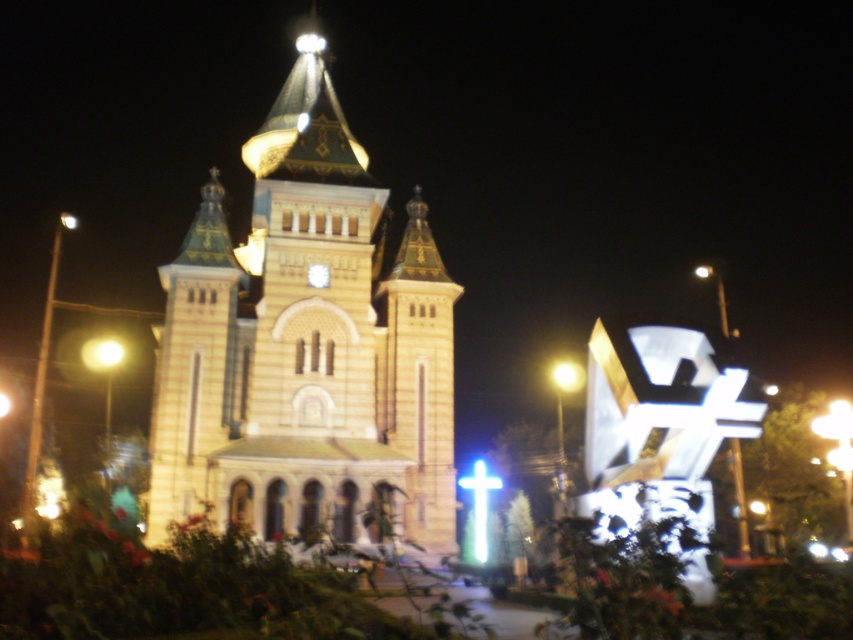
Question: Where is golden stone church at center located in relation to yellow matte light at center in the image?

Choices:
 (A) right
 (B) left

Answer: (B)

Question: Can you confirm if golden stone church at center is positioned to the right of yellow matte light at center?

Choices:
 (A) no
 (B) yes

Answer: (A)

Question: Among these points, which one is farthest from the camera?

Choices:
 (A) (567, 371)
 (B) (173, 280)

Answer: (A)

Question: Does golden stone church at center have a smaller size compared to yellow matte light at center?

Choices:
 (A) yes
 (B) no

Answer: (B)

Question: Among these objects, which one is nearest to the camera?

Choices:
 (A) golden stone church at center
 (B) yellow matte light at center

Answer: (A)